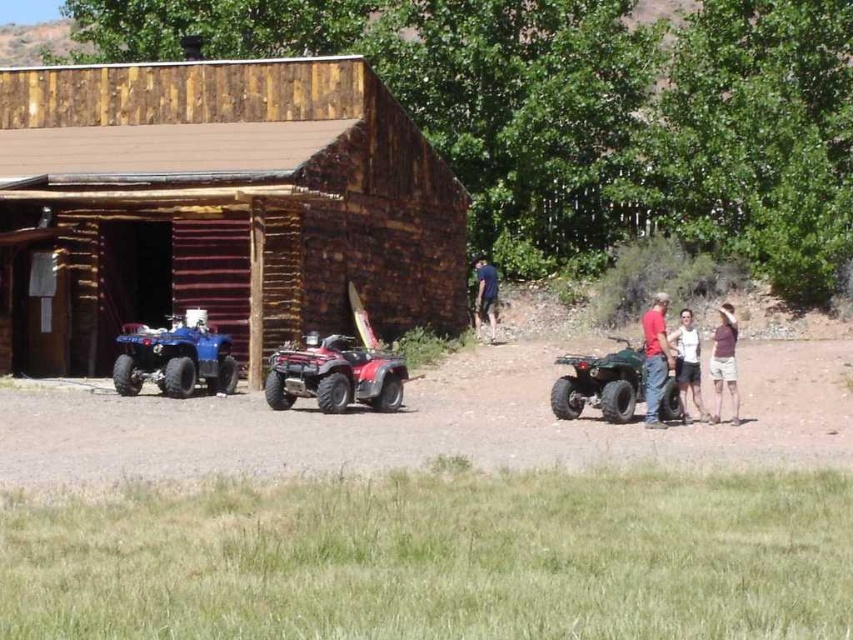
Question: Which of the following is the farthest from the observer?

Choices:
 (A) dirt track at center
 (B) blue matte quad bike at left
 (C) shiny red quad bike at center
 (D) dark blue fabric at center

Answer: (D)

Question: Is dirt track at center behind dark blue fabric at center?

Choices:
 (A) yes
 (B) no

Answer: (B)

Question: Can you confirm if green matte quad bike at right is positioned to the right of purple cotton shirt at right?

Choices:
 (A) no
 (B) yes

Answer: (A)

Question: Which object appears closest to the camera in this image?

Choices:
 (A) wooden barn at left
 (B) dark blue fabric at center
 (C) matte red shirt at right
 (D) white cotton shirt at right

Answer: (C)

Question: Does blue matte quad bike at left appear on the right side of white cotton shirt at right?

Choices:
 (A) no
 (B) yes

Answer: (A)

Question: Which of the following is the farthest from the observer?

Choices:
 (A) (120, 400)
 (B) (341, 355)

Answer: (A)